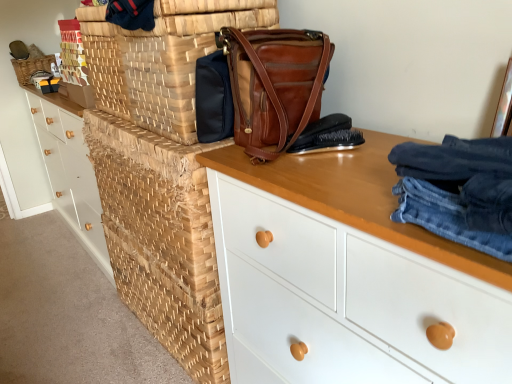
Question: Is natural woven basket at upper left, the second basket positioned from the bottom, in front of or behind woven wood chest of drawers at left, acting as the 2th chest of drawers starting from the front, in the image?

Choices:
 (A) behind
 (B) front

Answer: (A)

Question: In terms of width, does natural woven basket at upper left, the first basket in the top-to-bottom sequence, look wider or thinner when compared to woven wood chest of drawers at left, positioned as the second chest of drawers in right-to-left order?

Choices:
 (A) thin
 (B) wide

Answer: (A)

Question: Estimate the real-world distances between objects in this image. Which object is farther from the brown woven basket at center, which ranks as the second basket in back-to-front order?

Choices:
 (A) woven wood chest of drawers at left, the 1th chest of drawers in the back-to-front sequence
 (B) white matte chest of drawers at center, which is counted as the 2th chest of drawers, starting from the back
 (C) woven wood basket at center
 (D) natural woven basket at upper left, the second basket positioned from the bottom
 (E) brown leather handbag at center

Answer: (D)

Question: Based on their relative distances, which object is nearer to the woven wood basket at center?

Choices:
 (A) natural woven basket at upper left, the first basket in the top-to-bottom sequence
 (B) brown leather handbag at center
 (C) white matte chest of drawers at center, which is the 2th chest of drawers from left to right
 (D) brown woven basket at center, the 1th basket positioned from the bottom
 (E) brown leather brush at center

Answer: (D)